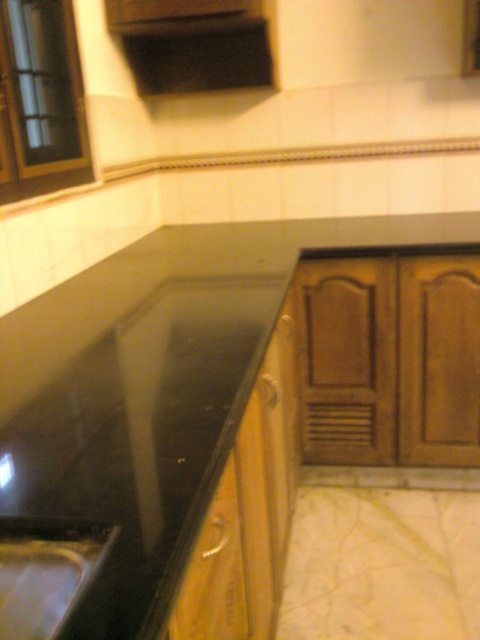
Looking at this image, who is lower down, black matte exhaust hood at upper center or black glossy sink at lower left?

black glossy sink at lower left is lower down.

Which is behind, point (252, 13) or point (47, 600)?

Point (252, 13)

Does point (240, 20) lie behind point (26, 531)?

Yes, it is behind point (26, 531).

Identify the location of black matte exhaust hood at upper center. This screenshot has height=640, width=480. (192, 44).

Does black granite countertop at center have a smaller size compared to black glossy sink at lower left?

Actually, black granite countertop at center might be larger than black glossy sink at lower left.

Is point (416, 216) in front of point (47, 584)?

No.

Identify the location of black granite countertop at center. (180, 278).

Is point (44, 589) less distant than point (223, 525)?

That is True.

Between point (71, 605) and point (197, 602), which one is positioned behind?

Positioned behind is point (197, 602).

Where is `black glossy sink at lower left`? This screenshot has width=480, height=640. black glossy sink at lower left is located at coordinates (47, 572).